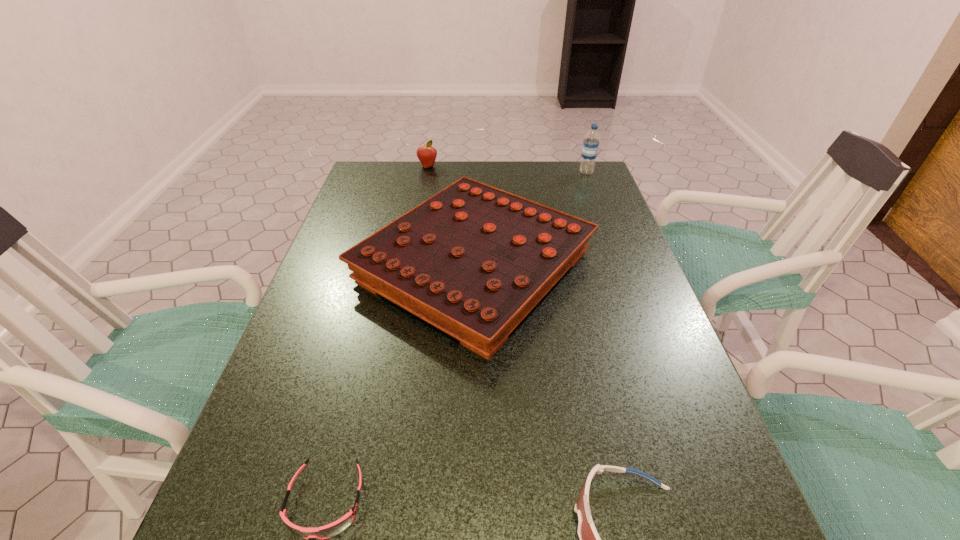
Identify the location of water bottle. The image size is (960, 540). (591, 142).

The image size is (960, 540). I want to click on the rightmost object, so click(591, 142).

Where is `apple`? apple is located at coordinates (426, 154).

Identify the location of gameboard. Image resolution: width=960 pixels, height=540 pixels. (473, 260).

The width and height of the screenshot is (960, 540). In order to click on free spot located 0.330m on the label of the tallest object in this screenshot , I will do (483, 172).

Identify the location of blank space located on the label of the tallest object. This screenshot has height=540, width=960. (477, 172).

Where is `vacant space located on the label of the tallest object`? This screenshot has height=540, width=960. vacant space located on the label of the tallest object is located at coordinates (556, 172).

Identify the location of vacant space located on the front of the apple. The width and height of the screenshot is (960, 540). (425, 179).

Where is `vacant space located on the left of the third farthest object`? vacant space located on the left of the third farthest object is located at coordinates (320, 267).

Image resolution: width=960 pixels, height=540 pixels. Find the location of `water bottle located at the far edge`. water bottle located at the far edge is located at coordinates (591, 142).